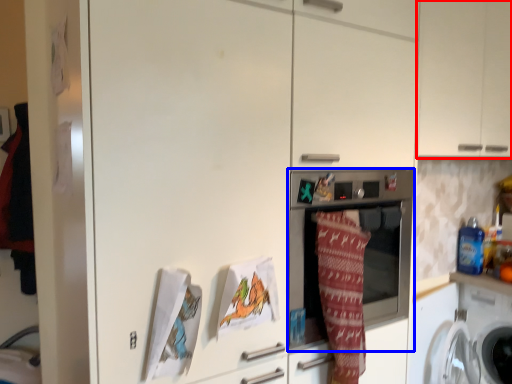
Question: Which object is closer to the camera taking this photo, cabinetry (highlighted by a red box) or home appliance (highlighted by a blue box)?

Choices:
 (A) cabinetry
 (B) home appliance

Answer: (B)